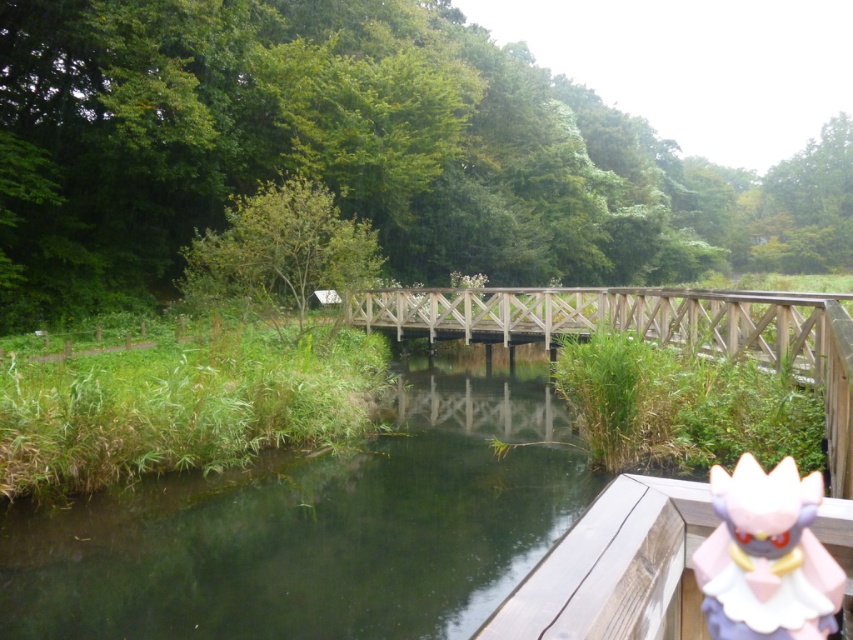
Question: Can you confirm if wooden bridge at center is thinner than pink plastic doll at lower right?

Choices:
 (A) no
 (B) yes

Answer: (A)

Question: Can you confirm if wooden bridge at center is wider than pink plastic doll at lower right?

Choices:
 (A) yes
 (B) no

Answer: (A)

Question: Which of the following is the farthest from the observer?

Choices:
 (A) pink plastic doll at lower right
 (B) wooden bridge at center

Answer: (B)

Question: Is wooden bridge at center in front of pink plastic doll at lower right?

Choices:
 (A) no
 (B) yes

Answer: (A)